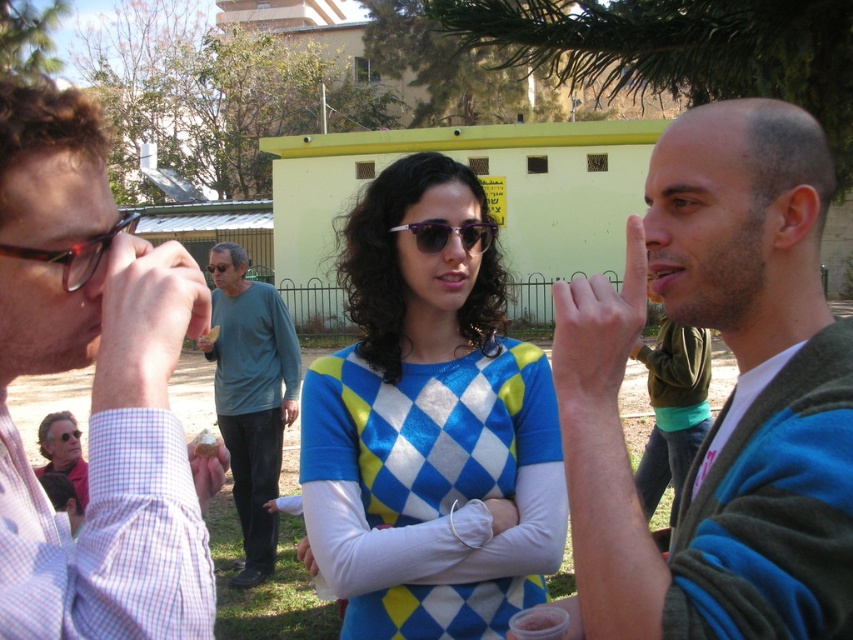
Can you confirm if teal jersey at center is positioned to the left of purple acetate sunglasses at center?

Correct, you'll find teal jersey at center to the left of purple acetate sunglasses at center.

Measure the distance between point (288, 378) and camera.

Point (288, 378) is 21.15 feet from camera.

Find the location of a particular element. The width and height of the screenshot is (853, 640). teal jersey at center is located at coordinates (252, 400).

Does blue sweater at center have a larger size compared to blue diamond-patterned sweater at center?

Incorrect, blue sweater at center is not larger than blue diamond-patterned sweater at center.

What do you see at coordinates (729, 396) in the screenshot? The image size is (853, 640). I see `blue sweater at center` at bounding box center [729, 396].

I want to click on blue sweater at center, so click(x=729, y=396).

Can you confirm if argyle sweater at center is positioned below matte black glasses at upper left?

Yes, argyle sweater at center is below matte black glasses at upper left.

What do you see at coordinates (428, 428) in the screenshot? Image resolution: width=853 pixels, height=640 pixels. I see `argyle sweater at center` at bounding box center [428, 428].

This screenshot has height=640, width=853. I want to click on argyle sweater at center, so click(428, 428).